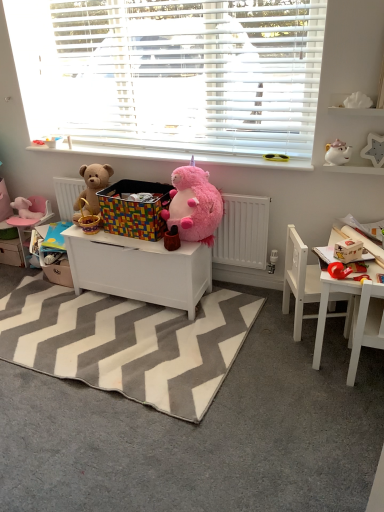
At what (x,y) coordinates should I click in order to perform the action: click on free space that is to the left of shiny yellow sunglasses at upper center, marked as the 4th toy in a right-to-left arrangement. Please return your answer as a coordinate pair (x, y). Image resolution: width=384 pixels, height=512 pixels. Looking at the image, I should click on (249, 160).